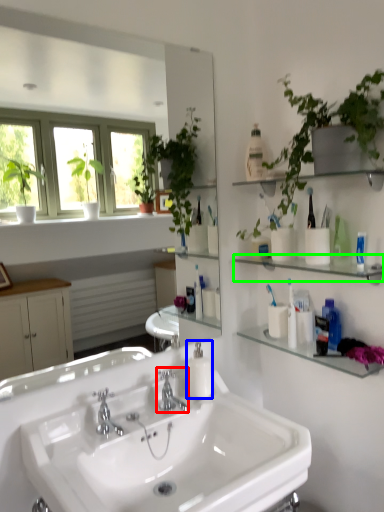
Question: Which object is the closest to the tap (highlighted by a red box)? Choose among these: soap dispenser (highlighted by a blue box) or shelf (highlighted by a green box).

Choices:
 (A) soap dispenser
 (B) shelf

Answer: (A)